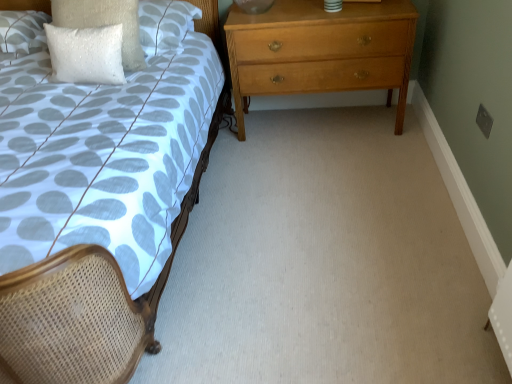
The height and width of the screenshot is (384, 512). I want to click on space that is in front of light brown wooden chest of drawers at right, so click(334, 177).